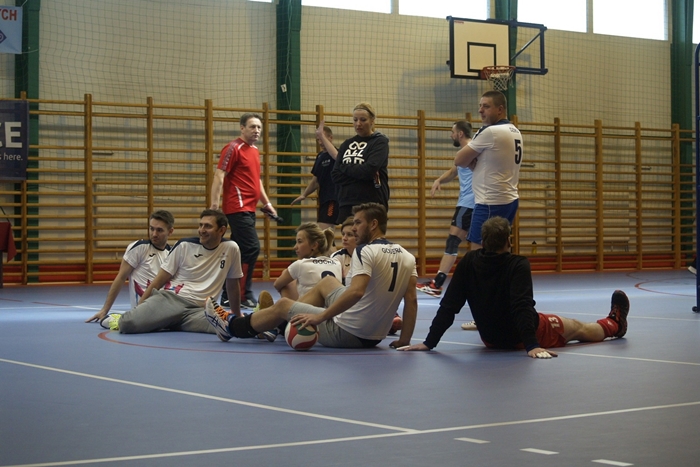
Locate an element on the screen. This screenshot has height=467, width=700. hanging banners is located at coordinates (15, 122), (14, 28).